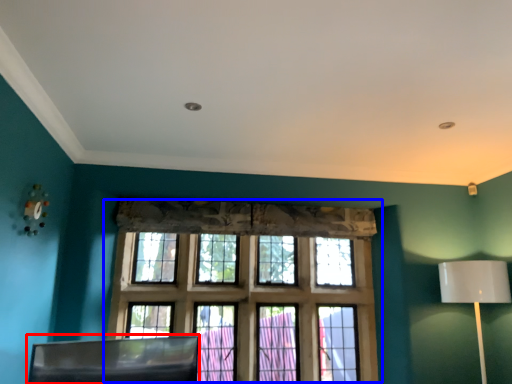
Question: Which of the following is the farthest to the observer, swivel chair (highlighted by a red box) or window (highlighted by a blue box)?

Choices:
 (A) swivel chair
 (B) window

Answer: (B)